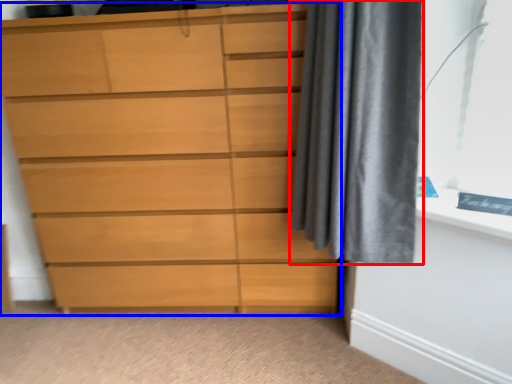
Question: Which point is further to the camera, curtain (highlighted by a red box) or chest of drawers (highlighted by a blue box)?

Choices:
 (A) curtain
 (B) chest of drawers

Answer: (B)